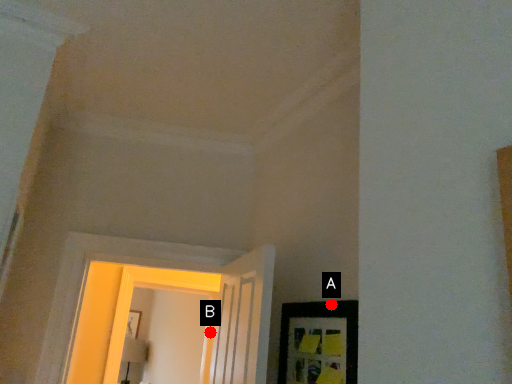
Question: Two points are circled on the image, labeled by A and B beside each circle. Among these points, which one is nearest to the camera?

Choices:
 (A) A is closer
 (B) B is closer

Answer: (A)